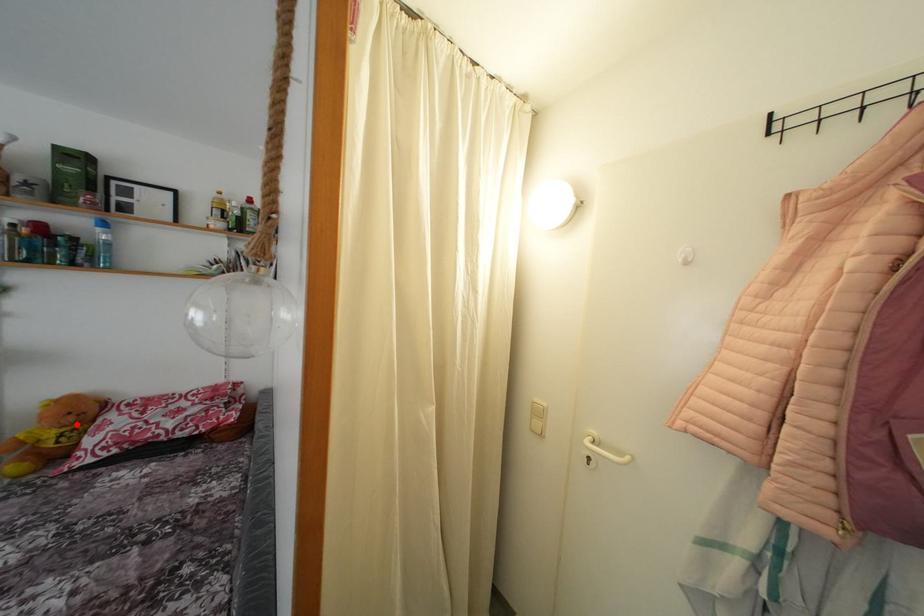
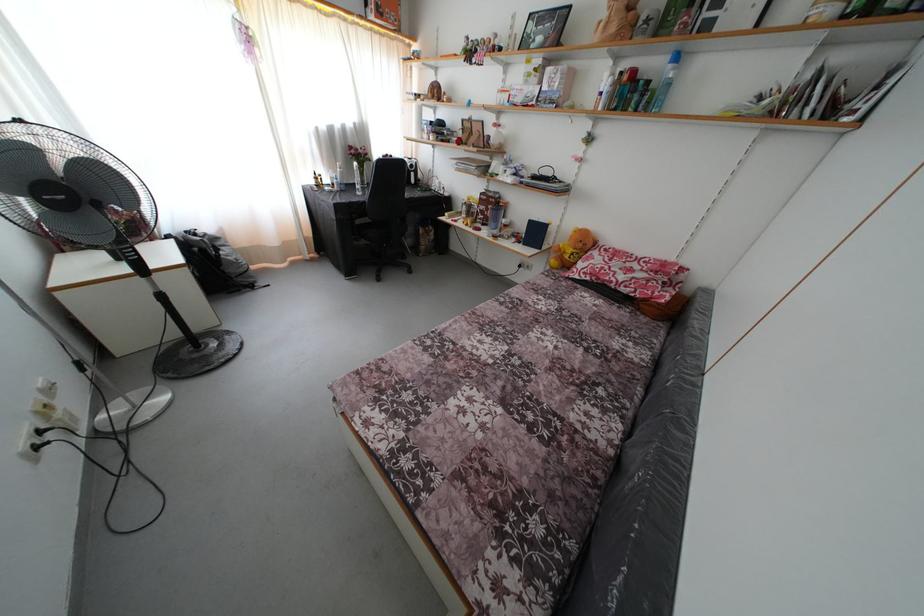
Question: I am providing you with two images of the same scene from different viewpoints. A red point is shown in image1. For the corresponding object point in image2, is it positioned nearer or farther from the camera?

Choices:
 (A) Nearer
 (B) Farther

Answer: (A)